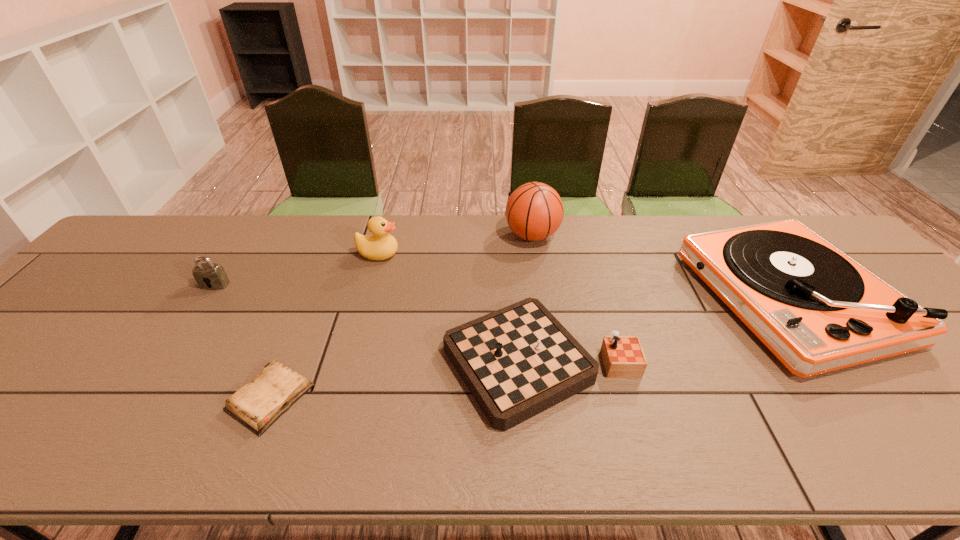
At what (x,y) coordinates should I click in order to perform the action: click on basketball situated at the far edge. Please return your answer as a coordinate pair (x, y). The width and height of the screenshot is (960, 540). Looking at the image, I should click on pos(534,211).

At what (x,y) coordinates should I click in order to perform the action: click on duck at the far edge. Please return your answer as a coordinate pair (x, y). The image size is (960, 540). Looking at the image, I should click on (381, 245).

You are a GUI agent. You are given a task and a screenshot of the screen. Output one action in this format:
    pyautogui.click(x=<x>, y=<y>)
    Task: Click on the chessboard that is at the near edge
    Image resolution: width=960 pixels, height=540 pixels.
    Given the screenshot: What is the action you would take?
    coord(518,361)

The height and width of the screenshot is (540, 960). What are the coordinates of `diary at the near edge` in the screenshot? It's located at [x=257, y=405].

At what (x,y) coordinates should I click in order to perform the action: click on free space at the far edge of the desktop. Please return your answer as a coordinate pair (x, y). The image size is (960, 540). Looking at the image, I should click on (656, 225).

The height and width of the screenshot is (540, 960). What are the coordinates of `vacant region at the near edge of the desktop` in the screenshot? It's located at (420, 459).

This screenshot has width=960, height=540. In the image, there is a desktop. Identify the location of free space at the right edge. (958, 415).

In the image, there is a desktop. Identify the location of free region at the far left corner. (156, 233).

You are a GUI agent. You are given a task and a screenshot of the screen. Output one action in this format:
    pyautogui.click(x=<x>, y=<y>)
    Task: Click on the empty location between the duck and the shortest object
    
    Given the screenshot: What is the action you would take?
    pyautogui.click(x=324, y=326)

Find the location of `free point between the leftmost object and the fifth tallest object`. free point between the leftmost object and the fifth tallest object is located at coordinates (377, 324).